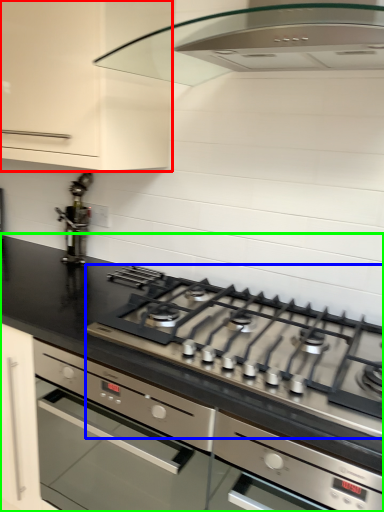
Question: Estimate the real-world distances between objects in this image. Which object is farther from cabinetry (highlighted by a red box), gas stove (highlighted by a blue box) or countertop (highlighted by a green box)?

Choices:
 (A) gas stove
 (B) countertop

Answer: (A)